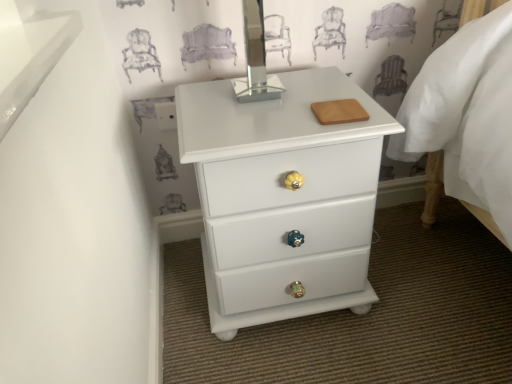
Find the location of a particular element. white glossy chest of drawers at center is located at coordinates (283, 195).

This screenshot has width=512, height=384. Describe the element at coordinates (283, 195) in the screenshot. I see `white glossy chest of drawers at center` at that location.

Where is `white glossy chest of drawers at center`? Image resolution: width=512 pixels, height=384 pixels. white glossy chest of drawers at center is located at coordinates (x=283, y=195).